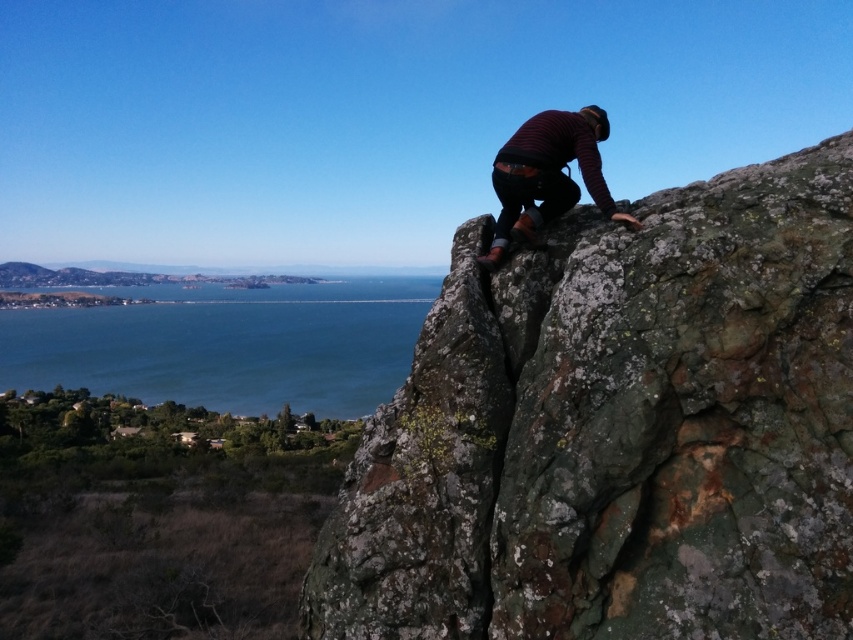
Who is more forward, (643, 490) or (596, 204)?

Point (643, 490)

Does rusty rock at upper right have a smaller size compared to striped wool sweater at upper right?

No.

Find the location of `rusty rock at upper right`. rusty rock at upper right is located at coordinates (618, 432).

Is blue water at lower left shorter than striped wool sweater at upper right?

In fact, blue water at lower left may be taller than striped wool sweater at upper right.

Who is more distant from viewer, (396, 346) or (561, 189)?

Positioned behind is point (396, 346).

What are the coordinates of `blue water at lower left` in the screenshot? It's located at (219, 353).

Can you confirm if rusty rock at upper right is positioned to the left of blue water at lower left?

Incorrect, rusty rock at upper right is not on the left side of blue water at lower left.

Who is more forward, (419, 355) or (22, 333)?

Point (419, 355) is more forward.

Is point (381, 474) behind point (361, 307)?

No.

You are a GUI agent. You are given a task and a screenshot of the screen. Output one action in this format:
    pyautogui.click(x=<x>, y=<y>)
    Task: Click on the rusty rock at upper right
    This screenshot has width=853, height=640.
    Given the screenshot: What is the action you would take?
    pyautogui.click(x=618, y=432)